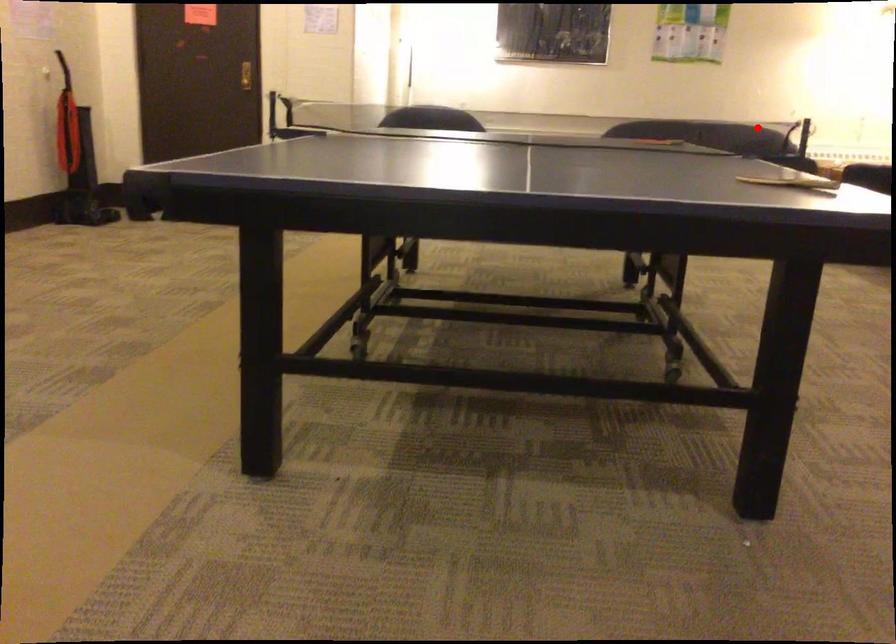
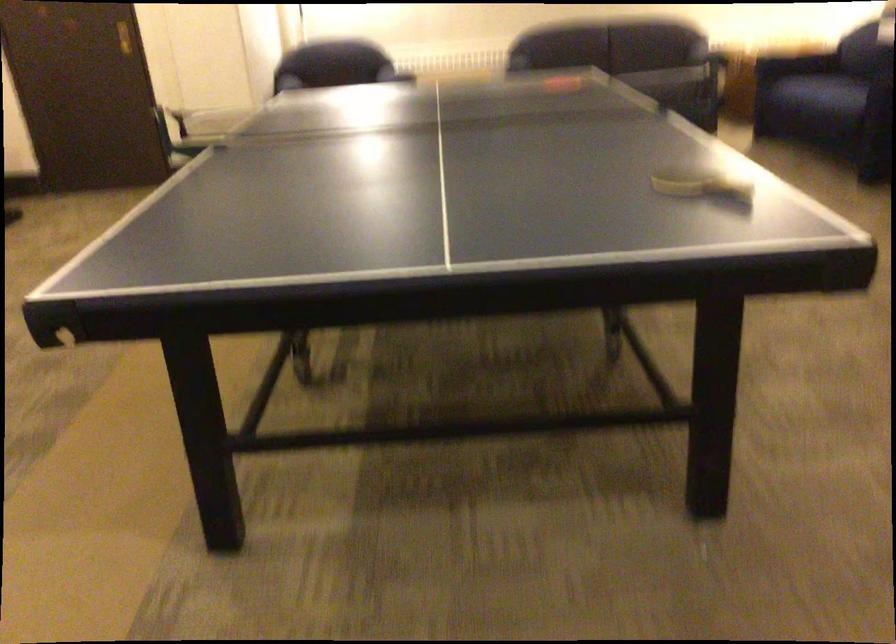
Locate, in the second image, the point that corresponds to the highlighted location in the first image.

(668, 82)